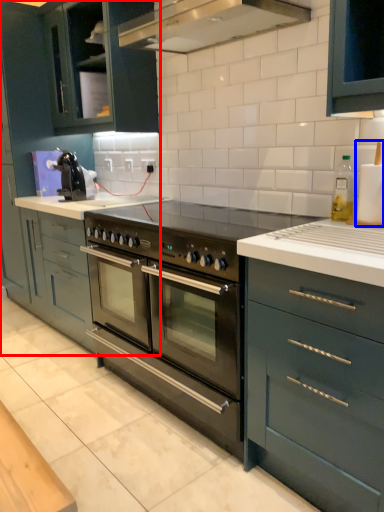
Question: Among these objects, which one is nearest to the camera, cabinetry (highlighted by a red box) or appliance (highlighted by a blue box)?

Choices:
 (A) cabinetry
 (B) appliance

Answer: (B)